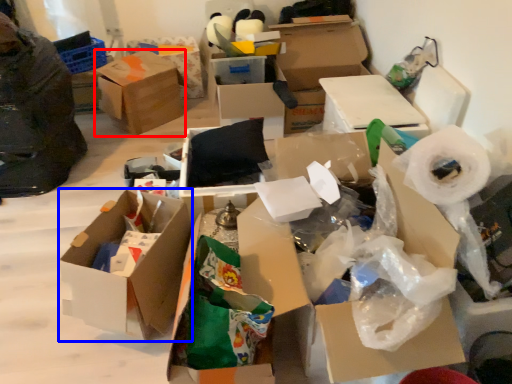
Question: Among these objects, which one is nearest to the camera, box (highlighted by a red box) or box (highlighted by a blue box)?

Choices:
 (A) box
 (B) box

Answer: (B)